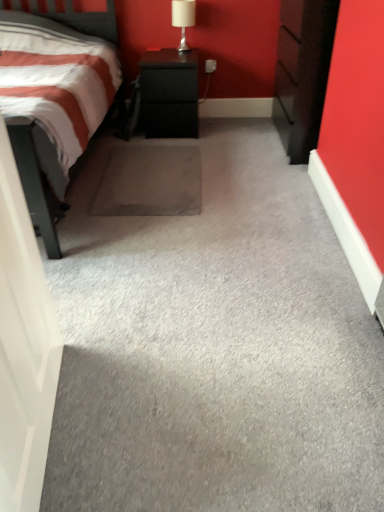
The image size is (384, 512). Find the location of `free space below white glossy table lamp at upper center (from a real-world perspective)`. free space below white glossy table lamp at upper center (from a real-world perspective) is located at coordinates click(182, 50).